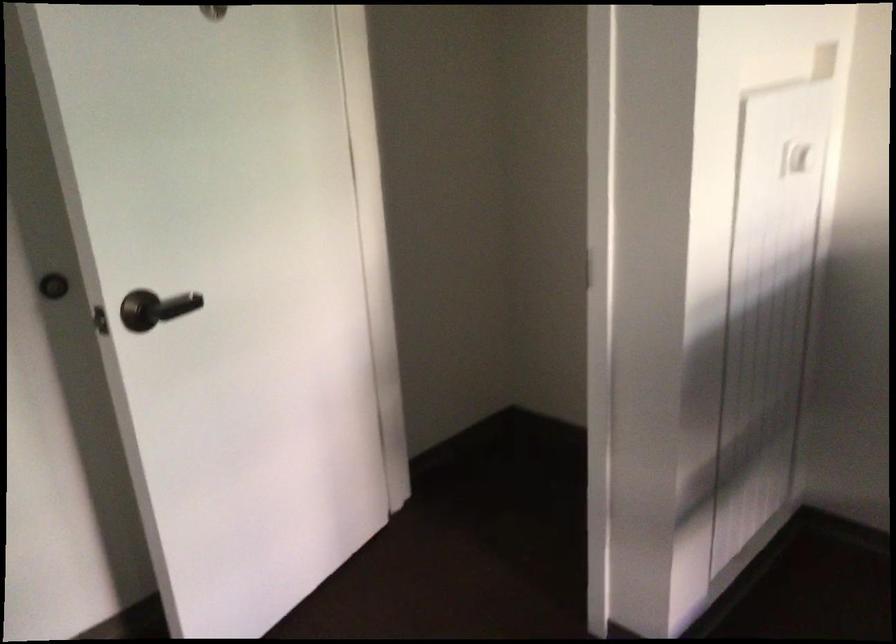
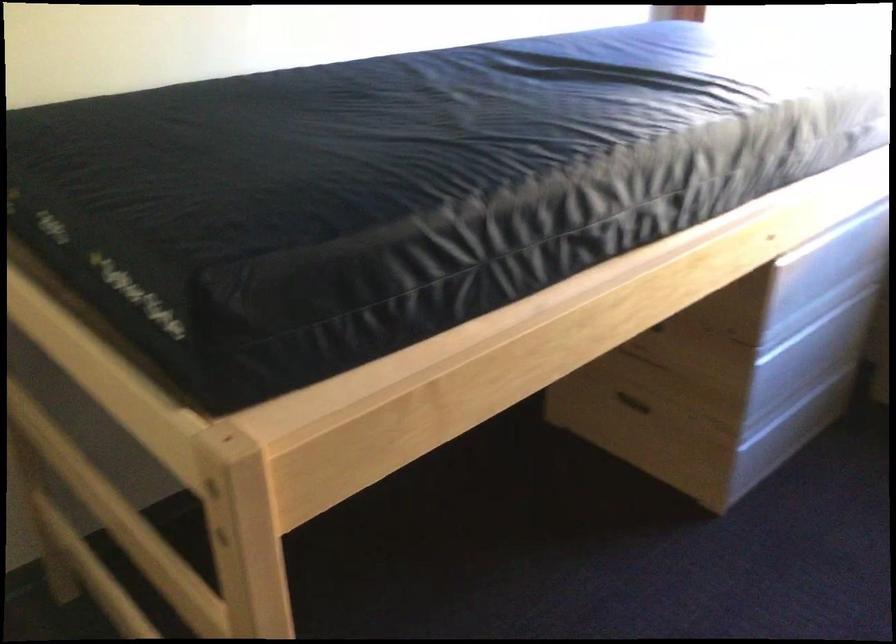
Based on the photo, the images are taken continuously from a first-person perspective. In which direction is your viewpoint rotating?

The rotation direction of the camera is right-down.